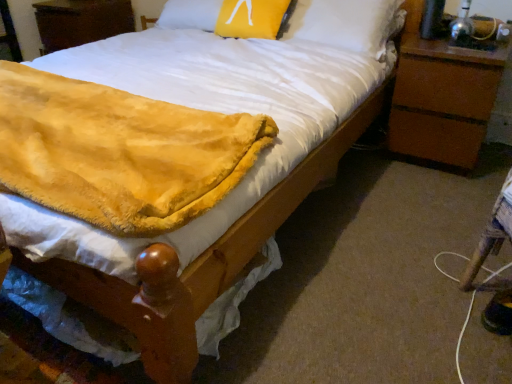
Question: Can you confirm if brown wood nightstand at right, which is counted as the second nightstand, starting from the left, is wider than fuzzy yellow blanket at lower left?

Choices:
 (A) no
 (B) yes

Answer: (A)

Question: Does brown wood nightstand at right, acting as the 1th nightstand starting from the front, turn towards fuzzy yellow blanket at lower left?

Choices:
 (A) no
 (B) yes

Answer: (A)

Question: Does brown wood nightstand at right, marked as the 1th nightstand in a bottom-to-top arrangement, appear on the right side of fuzzy yellow blanket at lower left?

Choices:
 (A) no
 (B) yes

Answer: (B)

Question: Considering the relative sizes of brown wood nightstand at right, marked as the 1th nightstand in a bottom-to-top arrangement, and fuzzy yellow blanket at lower left in the image provided, is brown wood nightstand at right, marked as the 1th nightstand in a bottom-to-top arrangement, shorter than fuzzy yellow blanket at lower left?

Choices:
 (A) no
 (B) yes

Answer: (A)

Question: Does brown wood nightstand at right, which is counted as the first nightstand, starting from the right, have a lesser width compared to fuzzy yellow blanket at lower left?

Choices:
 (A) no
 (B) yes

Answer: (B)

Question: Looking at their shapes, would you say wooden nightstand at upper left, placed as the second nightstand when sorted from right to left, is wider or thinner than yellow fuzzy pillow at upper center?

Choices:
 (A) wide
 (B) thin

Answer: (A)

Question: Looking at the image, does wooden nightstand at upper left, acting as the second nightstand starting from the front, seem bigger or smaller compared to yellow fuzzy pillow at upper center?

Choices:
 (A) big
 (B) small

Answer: (A)

Question: From a real-world perspective, is wooden nightstand at upper left, the first nightstand in the left-to-right sequence, positioned above or below yellow fuzzy pillow at upper center?

Choices:
 (A) above
 (B) below

Answer: (B)

Question: From the image's perspective, is wooden nightstand at upper left, the first nightstand in the left-to-right sequence, positioned above or below yellow fuzzy pillow at upper center?

Choices:
 (A) above
 (B) below

Answer: (A)

Question: Is point (252, 8) positioned closer to the camera than point (482, 81)?

Choices:
 (A) closer
 (B) farther

Answer: (B)

Question: Would you say yellow fuzzy pillow at upper center is inside or outside brown wood nightstand at right, placed as the second nightstand when sorted from back to front?

Choices:
 (A) outside
 (B) inside

Answer: (A)

Question: Is yellow fuzzy pillow at upper center bigger or smaller than brown wood nightstand at right, which is counted as the first nightstand, starting from the right?

Choices:
 (A) small
 (B) big

Answer: (A)

Question: Considering the positions of yellow fuzzy pillow at upper center and brown wood nightstand at right, arranged as the 2th nightstand when viewed from the top, in the image, is yellow fuzzy pillow at upper center taller or shorter than brown wood nightstand at right, arranged as the 2th nightstand when viewed from the top,?

Choices:
 (A) tall
 (B) short

Answer: (B)

Question: Based on their sizes in the image, would you say fuzzy yellow blanket at lower left is bigger or smaller than brown wood nightstand at right, which is counted as the first nightstand, starting from the right?

Choices:
 (A) small
 (B) big

Answer: (A)

Question: Considering their positions, is fuzzy yellow blanket at lower left located in front of or behind brown wood nightstand at right, placed as the second nightstand when sorted from back to front?

Choices:
 (A) behind
 (B) front

Answer: (B)